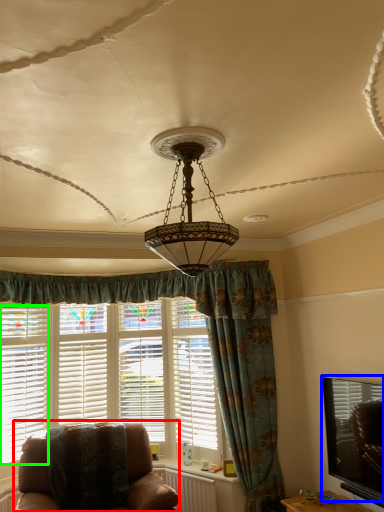
Question: Based on their relative distances, which object is farther from chair (highlighted by a red box)? Choose from window screen (highlighted by a blue box) and blind (highlighted by a green box).

Choices:
 (A) window screen
 (B) blind

Answer: (A)